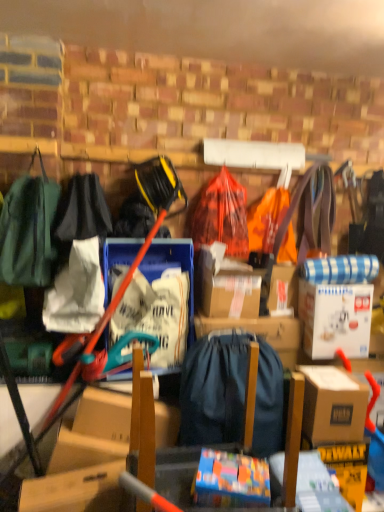
Question: Is brown cardboard box at right, which appears as the 2th box when viewed from the top, located outside black fabric bag at left, which is the 3th clothing in left-to-right order?

Choices:
 (A) yes
 (B) no

Answer: (A)

Question: Does brown cardboard box at right, positioned as the 1th box in bottom-to-top order, have a lesser height compared to black fabric bag at left, the second clothing viewed from the right?

Choices:
 (A) no
 (B) yes

Answer: (B)

Question: Considering the relative positions of brown cardboard box at right, marked as the 1th box in a front-to-back arrangement, and black fabric bag at left, which is the 3th clothing in left-to-right order, in the image provided, is brown cardboard box at right, marked as the 1th box in a front-to-back arrangement, behind black fabric bag at left, which is the 3th clothing in left-to-right order,?

Choices:
 (A) yes
 (B) no

Answer: (B)

Question: Considering the relative sizes of brown cardboard box at right, marked as the 1th box in a front-to-back arrangement, and black fabric bag at left, which is the 3th clothing in left-to-right order, in the image provided, is brown cardboard box at right, marked as the 1th box in a front-to-back arrangement, wider than black fabric bag at left, which is the 3th clothing in left-to-right order,?

Choices:
 (A) no
 (B) yes

Answer: (A)

Question: Considering the relative sizes of brown cardboard box at right, arranged as the 2th box when viewed from the back, and black fabric bag at left, the second clothing viewed from the right, in the image provided, is brown cardboard box at right, arranged as the 2th box when viewed from the back, thinner than black fabric bag at left, the second clothing viewed from the right,?

Choices:
 (A) yes
 (B) no

Answer: (A)

Question: Does brown cardboard box at right, arranged as the 2th box when viewed from the back, have a larger size compared to black fabric bag at left, the second clothing viewed from the right?

Choices:
 (A) yes
 (B) no

Answer: (B)

Question: Is white plastic bag at center, the 1th storage box viewed from the left, shorter than blue fabric bag at center, which is counted as the first storage box, starting from the right?

Choices:
 (A) yes
 (B) no

Answer: (B)

Question: Could blue fabric bag at center, acting as the second storage box starting from the left, be considered to be inside white plastic bag at center, which is the second storage box in right-to-left order?

Choices:
 (A) yes
 (B) no

Answer: (B)

Question: From the image's perspective, is white plastic bag at center, the 1th storage box viewed from the left, on blue fabric bag at center, acting as the second storage box starting from the left?

Choices:
 (A) no
 (B) yes

Answer: (B)

Question: Does white plastic bag at center, which is the second storage box in right-to-left order, lie behind blue fabric bag at center, acting as the second storage box starting from the left?

Choices:
 (A) no
 (B) yes

Answer: (A)

Question: Can you confirm if white plastic bag at center, the 1th storage box viewed from the left, is positioned to the left of blue fabric bag at center, which is counted as the first storage box, starting from the right?

Choices:
 (A) yes
 (B) no

Answer: (A)

Question: Is white plastic bag at center, which is the second storage box in right-to-left order, positioned far away from blue fabric bag at center, which is counted as the first storage box, starting from the right?

Choices:
 (A) no
 (B) yes

Answer: (A)

Question: Can we say green fabric backpack at left, which is the fourth clothing in right-to-left order, lies outside white cardboard box at upper right, which is the first box from back to front?

Choices:
 (A) no
 (B) yes

Answer: (B)